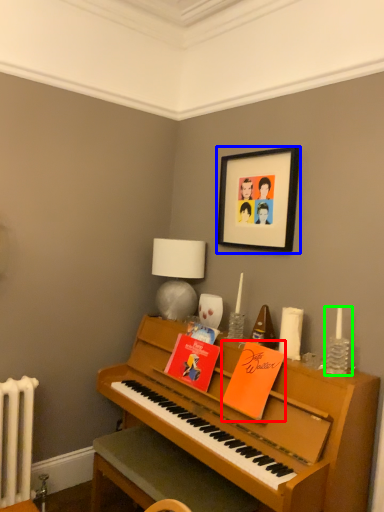
Question: Which is nearer to the book (highlighted by a red box)? picture frame (highlighted by a blue box) or candle holder (highlighted by a green box).

Choices:
 (A) picture frame
 (B) candle holder

Answer: (B)